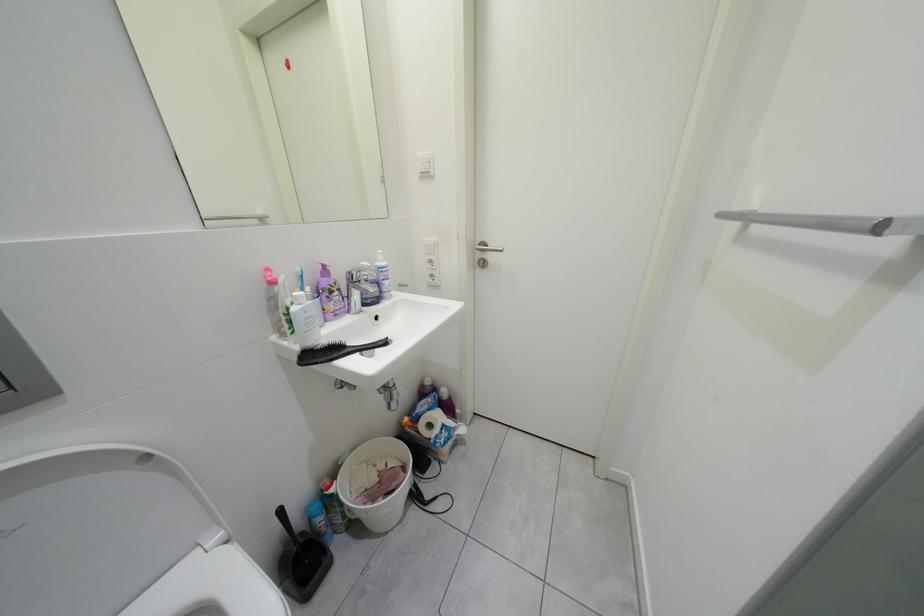
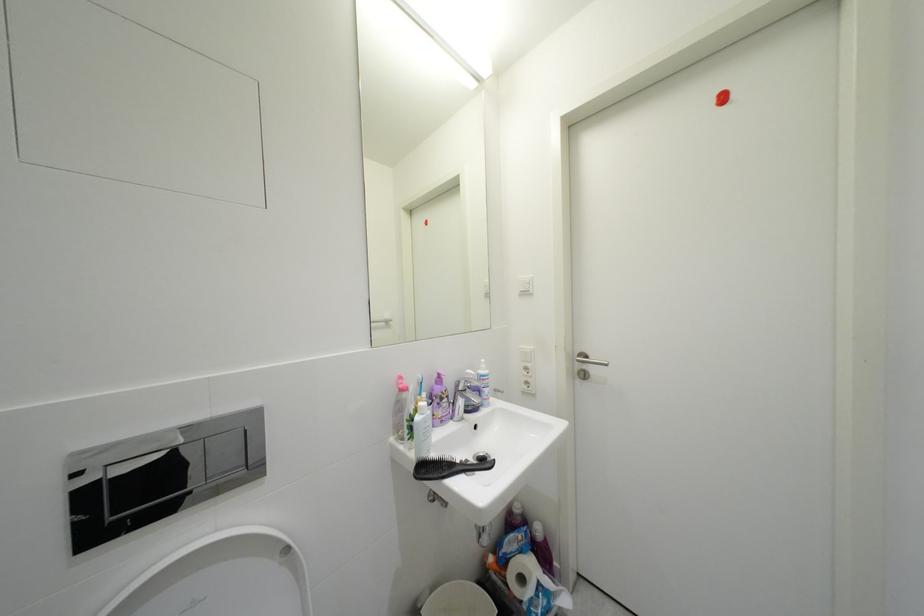
Based on the continuous images, in which direction is the camera rotating?

The rotation direction of the camera is left-up.